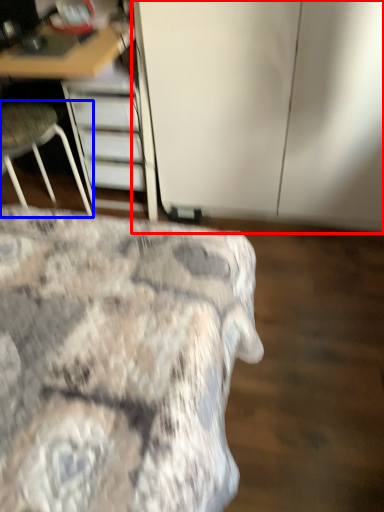
Question: Which of the following is the farthest to the observer, cabinetry (highlighted by a red box) or chair (highlighted by a blue box)?

Choices:
 (A) cabinetry
 (B) chair

Answer: (B)